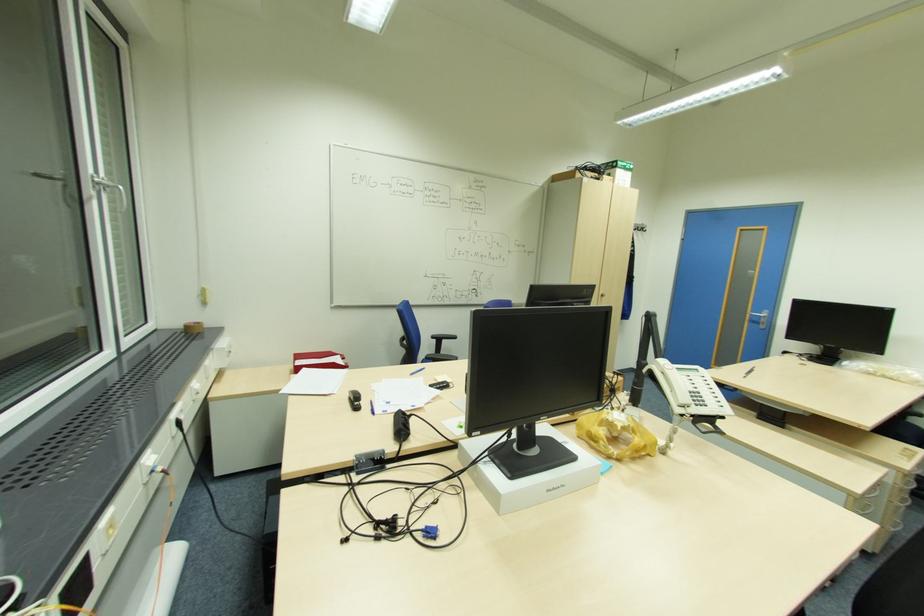
Find where to push the silver door handle. Please return your answer as a coordinate pair (x, y).

(759, 318)